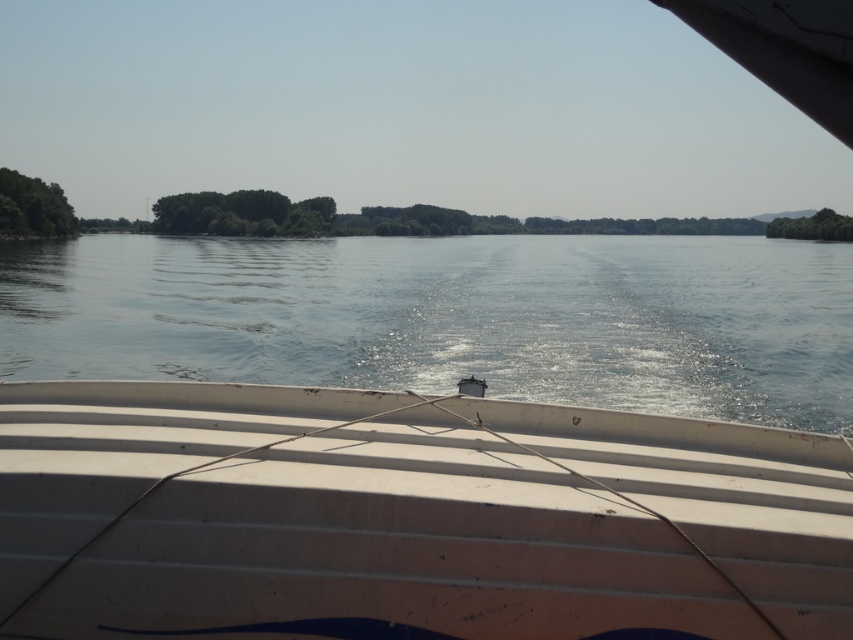
From the picture: You are standing on the dock and want to board the white corrugated plastic boat at center. The dock has a ramp that extends 3 meters into the river. Can you reach the boat by walking along the ramp?

The white corrugated plastic boat at center and camera are 3.18 meters apart. Since the ramp extends only 3 meters, you cannot reach the boat by walking along the ramp as it is 18 centimeters shorter than the required distance.

You are navigating a boat on a serene river. Your current position is at coordinates point A. You need to reach the white corrugated plastic boat at center. According to the map, your current coordinates are point B. Which direction should you steer to reach the boat?

The white corrugated plastic boat at center is located at point (408, 518). To determine the direction, you would need to compare your current coordinates with the boat. However, without knowing your exact starting point, it is impossible to provide a specific direction. Please provide your current coordinates for accurate guidance.